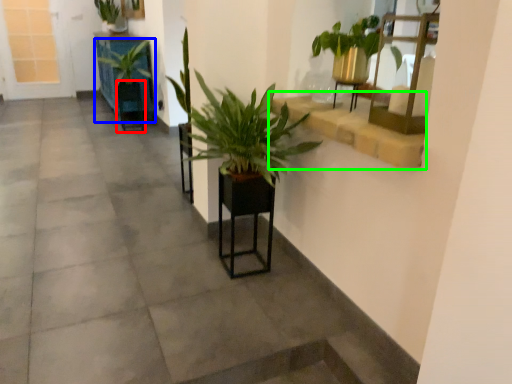
Question: Considering the real-world distances, which object is closest to armchair (highlighted by a red box)? houseplant (highlighted by a blue box) or window sill (highlighted by a green box).

Choices:
 (A) houseplant
 (B) window sill

Answer: (A)